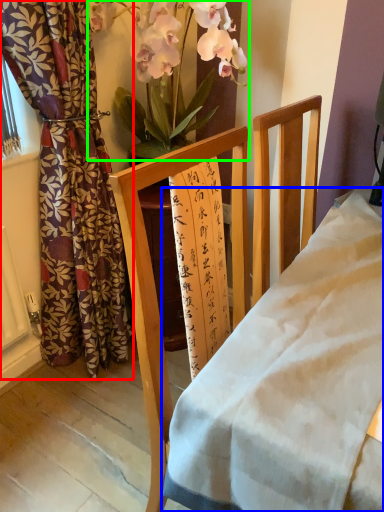
Question: Which object is positioned closest to curtain (highlighted by a red box)? Select from desk (highlighted by a blue box) and floral arrangement (highlighted by a green box).

Choices:
 (A) desk
 (B) floral arrangement

Answer: (B)